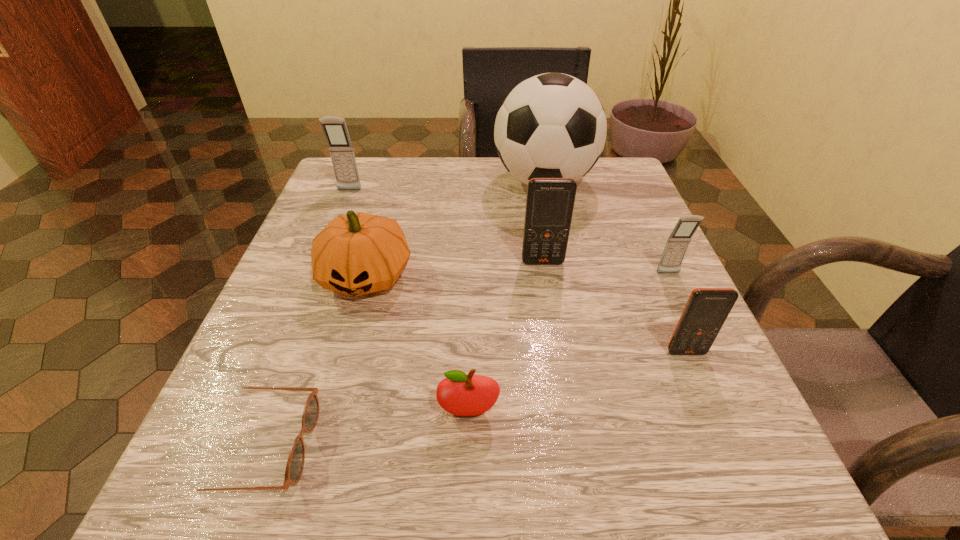
At what (x,y) coordinates should I click in order to perform the action: click on free region located on the front-facing side of the nearer gray cellular telephone. Please return your answer as a coordinate pair (x, y). The width and height of the screenshot is (960, 540). Looking at the image, I should click on (744, 437).

I want to click on vacant position located 0.240m on the back of the fifth object from right to left, so click(471, 283).

What are the coordinates of `free space located 0.200m on the front-facing side of the brown sunglasses` in the screenshot? It's located at (465, 446).

Where is `soccer ball located in the far edge section of the desktop`? This screenshot has height=540, width=960. soccer ball located in the far edge section of the desktop is located at coordinates (553, 125).

Where is `cellular telephone that is positioned at the far edge`? cellular telephone that is positioned at the far edge is located at coordinates (335, 130).

Identify the location of object that is positioned at the near edge. (295, 463).

Locate an element on the screen. The image size is (960, 540). cellular telephone that is at the left edge is located at coordinates (335, 130).

The image size is (960, 540). I want to click on gourd that is at the left edge, so click(x=358, y=253).

Find the location of `sunglasses present at the left edge`. sunglasses present at the left edge is located at coordinates (295, 463).

Identify the location of soccer ball situated at the right edge. The height and width of the screenshot is (540, 960). (553, 125).